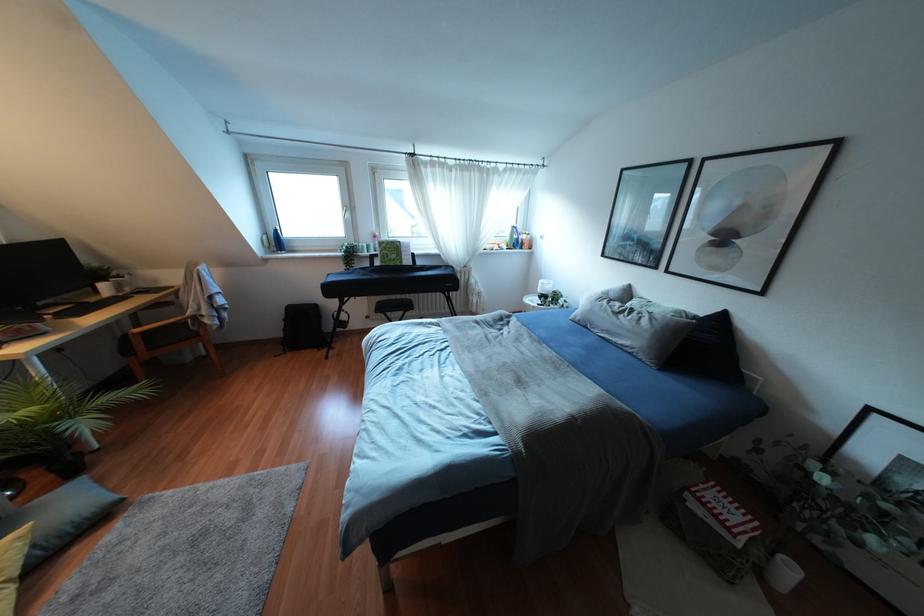
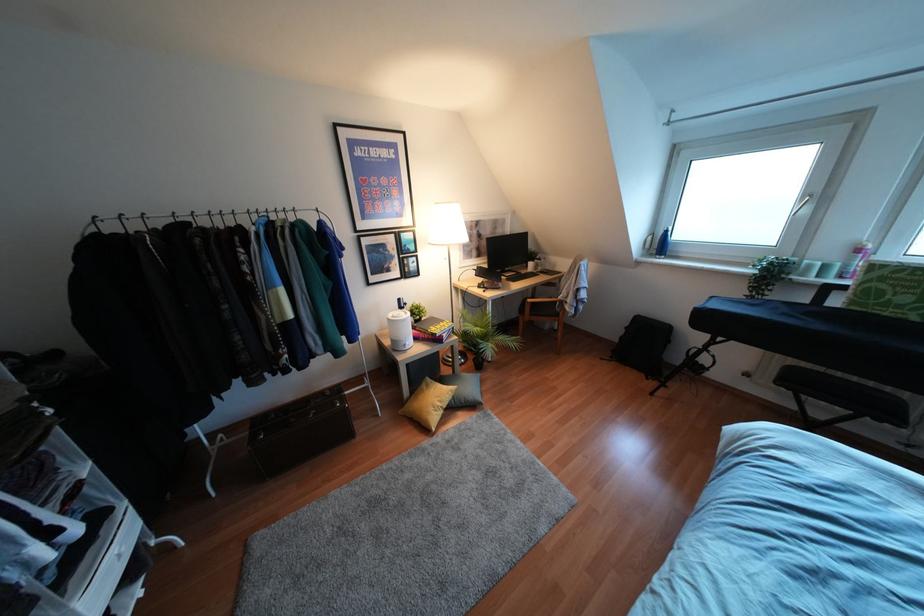
Question: The camera is either moving clockwise (left) or counter-clockwise (right) around the object. The first image is from the beginning of the video and the second image is from the end. Is the camera moving left or right when shooting the video?

Choices:
 (A) Left
 (B) Right

Answer: (B)